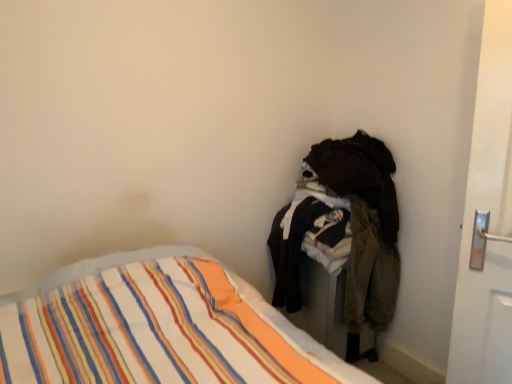
Question: Considering the relative sizes of striped fabric bed at lower left and dark fabric laundry at right in the image provided, is striped fabric bed at lower left smaller than dark fabric laundry at right?

Choices:
 (A) no
 (B) yes

Answer: (A)

Question: Is striped fabric bed at lower left thinner than dark fabric laundry at right?

Choices:
 (A) no
 (B) yes

Answer: (A)

Question: Is striped fabric bed at lower left at the left side of dark fabric laundry at right?

Choices:
 (A) yes
 (B) no

Answer: (A)

Question: Is striped fabric bed at lower left oriented away from dark fabric laundry at right?

Choices:
 (A) yes
 (B) no

Answer: (B)

Question: Is striped fabric bed at lower left aimed at dark fabric laundry at right?

Choices:
 (A) yes
 (B) no

Answer: (B)

Question: Is dark fabric laundry at right completely or partially inside striped fabric bed at lower left?

Choices:
 (A) no
 (B) yes

Answer: (A)

Question: Considering the relative positions of dark fabric laundry at right and striped fabric bed at lower left in the image provided, is dark fabric laundry at right to the right of striped fabric bed at lower left from the viewer's perspective?

Choices:
 (A) no
 (B) yes

Answer: (B)

Question: From a real-world perspective, is dark fabric laundry at right beneath striped fabric bed at lower left?

Choices:
 (A) yes
 (B) no

Answer: (B)

Question: Does dark fabric laundry at right come in front of striped fabric bed at lower left?

Choices:
 (A) no
 (B) yes

Answer: (A)

Question: Is the depth of dark fabric laundry at right greater than that of striped fabric bed at lower left?

Choices:
 (A) no
 (B) yes

Answer: (B)

Question: Is dark fabric laundry at right facing towards striped fabric bed at lower left?

Choices:
 (A) yes
 (B) no

Answer: (A)

Question: Considering the relative sizes of dark fabric laundry at right and striped fabric bed at lower left in the image provided, is dark fabric laundry at right smaller than striped fabric bed at lower left?

Choices:
 (A) yes
 (B) no

Answer: (A)

Question: In the image, is dark fabric laundry at right positioned in front of or behind striped fabric bed at lower left?

Choices:
 (A) front
 (B) behind

Answer: (B)